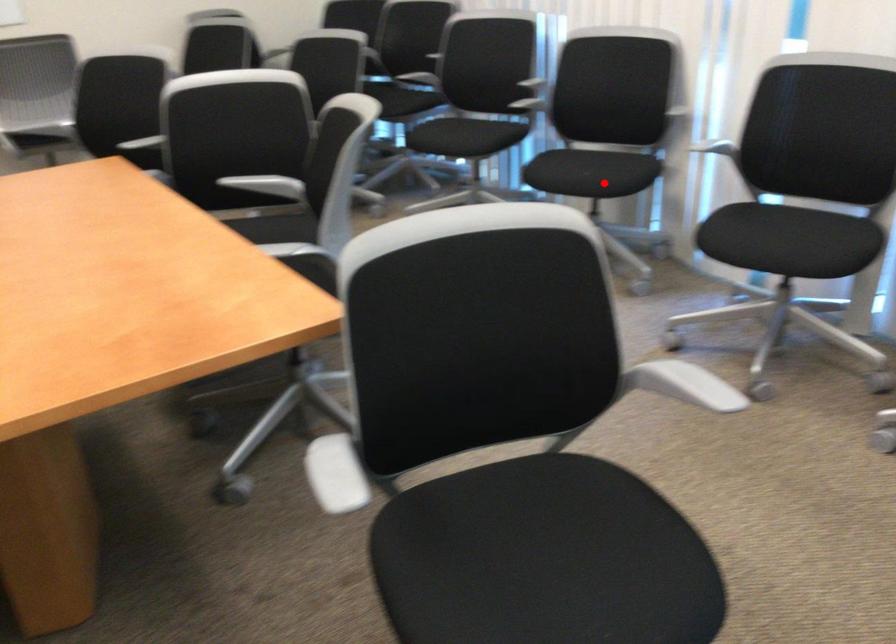
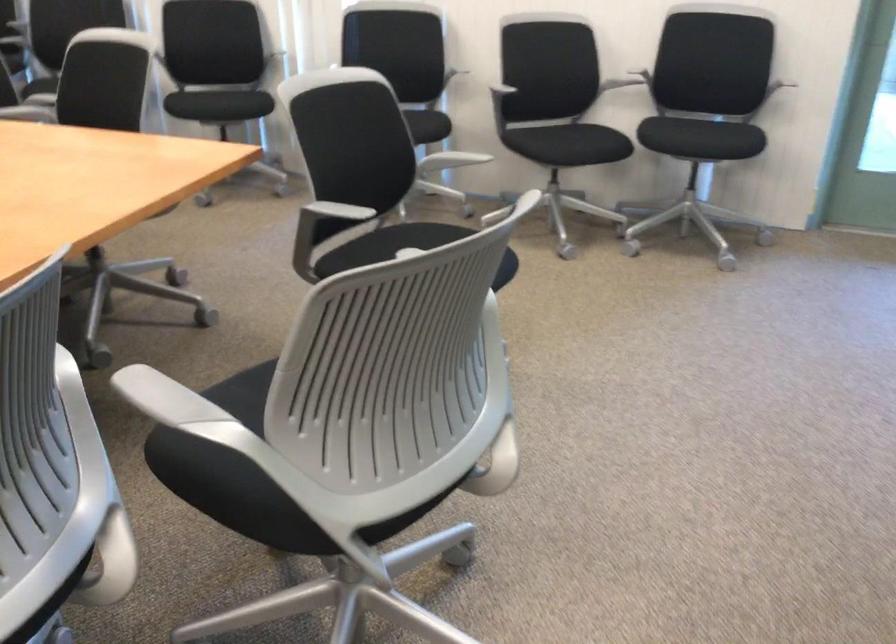
Question: I am providing you with two images of the same scene from different viewpoints. In image1, a red point is highlighted. Considering the same 3D point in image2, which of the following is correct?

Choices:
 (A) It is closer
 (B) It is farther

Answer: (B)